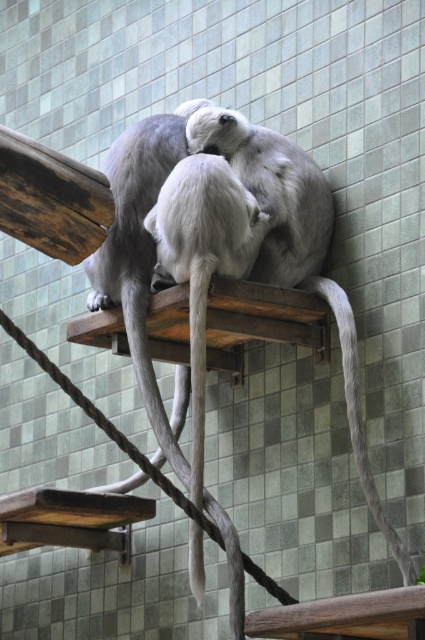
Who is positioned more to the right, gray furry tail at center or gray matte tail at lower right?

Positioned to the right is gray matte tail at lower right.

Between gray furry tail at center and gray matte tail at lower right, which one is positioned higher?

gray matte tail at lower right

The width and height of the screenshot is (425, 640). Find the location of `gray furry tail at center`. gray furry tail at center is located at coordinates (147, 365).

Image resolution: width=425 pixels, height=640 pixels. Find the location of `gray furry tail at center`. gray furry tail at center is located at coordinates (147, 365).